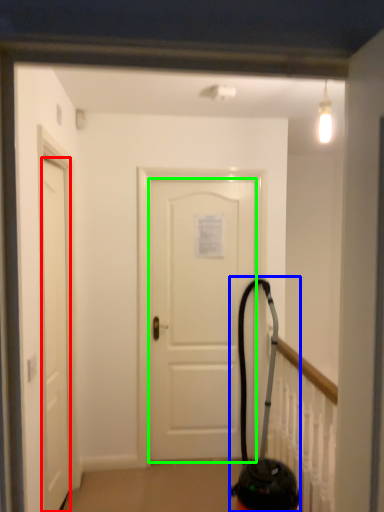
Question: Which object is the closest to the door (highlighted by a red box)? Choose among these: extinguisher (highlighted by a blue box) or door (highlighted by a green box).

Choices:
 (A) extinguisher
 (B) door

Answer: (B)